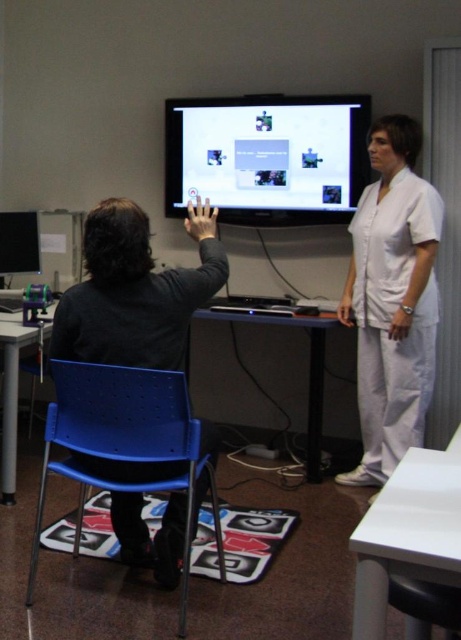
Question: Which point is farther to the camera?

Choices:
 (A) (287, 106)
 (B) (354, 257)
 (C) (53, 305)
 (D) (315, 408)

Answer: (C)

Question: Which of the following is the farthest from the observer?

Choices:
 (A) (65, 412)
 (B) (13, 496)

Answer: (B)

Question: Is black matte chair at left smaller than blue plastic chair at lower left?

Choices:
 (A) no
 (B) yes

Answer: (B)

Question: Does white glossy table at lower right have a greater width compared to metallic silver table at lower left?

Choices:
 (A) no
 (B) yes

Answer: (B)

Question: Which object is farther from the camera taking this photo?

Choices:
 (A) blue plastic chair at lower left
 (B) matte black monitor at left

Answer: (B)

Question: Does black matte chair at left have a smaller size compared to white glossy table at lower right?

Choices:
 (A) no
 (B) yes

Answer: (A)